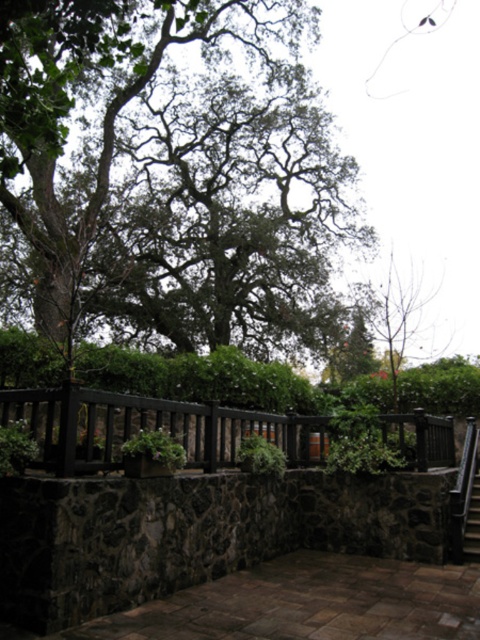
Question: Which is farther from the metallic staircase at center?

Choices:
 (A) black wood fence at center
 (B) green leafy tree at upper center

Answer: (B)

Question: Can you confirm if green leafy tree at upper center is positioned to the right of metallic staircase at center?

Choices:
 (A) no
 (B) yes

Answer: (A)

Question: Among these points, which one is nearest to the camera?

Choices:
 (A) (46, 392)
 (B) (194, 129)
 (C) (475, 458)

Answer: (A)

Question: Considering the real-world distances, which object is closest to the black wood fence at center?

Choices:
 (A) green leafy tree at upper center
 (B) metallic staircase at center

Answer: (B)

Question: In this image, where is green leafy tree at upper center located relative to metallic staircase at center?

Choices:
 (A) below
 (B) above

Answer: (B)

Question: Does black wood fence at center have a greater width compared to metallic staircase at center?

Choices:
 (A) yes
 (B) no

Answer: (B)